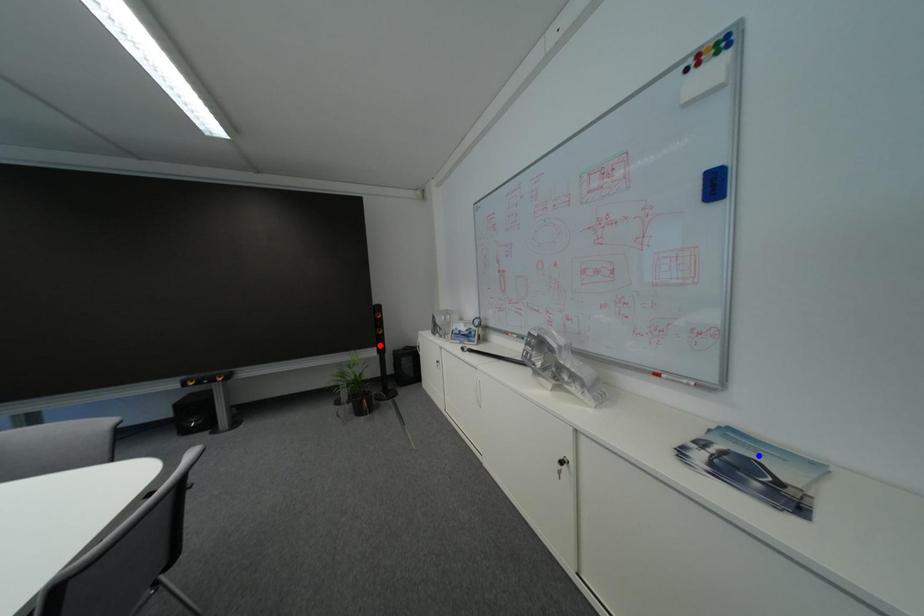
Question: Which of the two points in the image is closer to the camera?

Choices:
 (A) Blue point is closer.
 (B) Red point is closer.

Answer: (A)